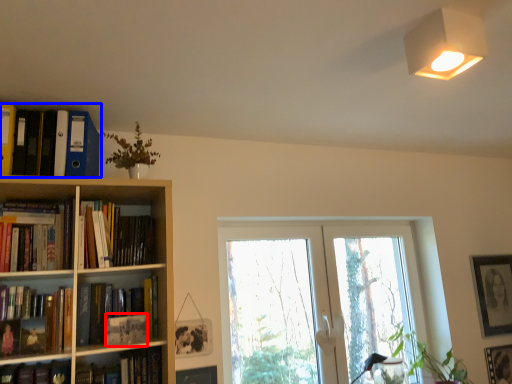
Question: Which point is further to the camera, paperback book (highlighted by a red box) or book (highlighted by a blue box)?

Choices:
 (A) paperback book
 (B) book

Answer: (A)